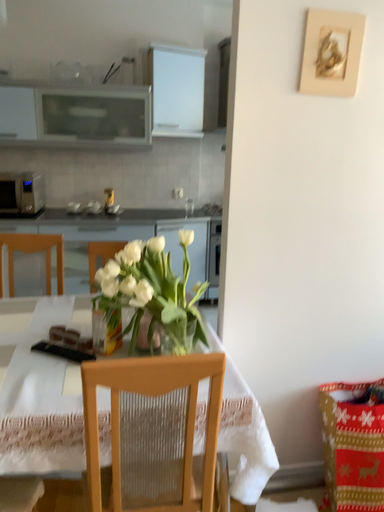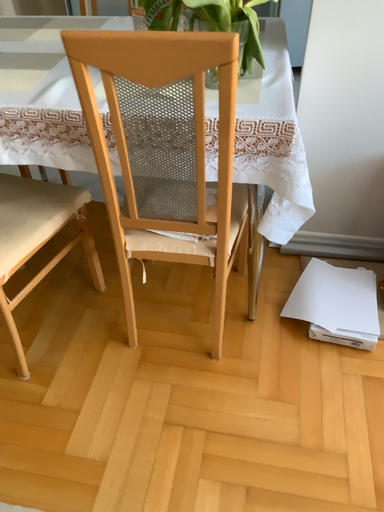
Question: How did the camera likely rotate when shooting the video?

Choices:
 (A) rotated upward
 (B) rotated downward

Answer: (B)